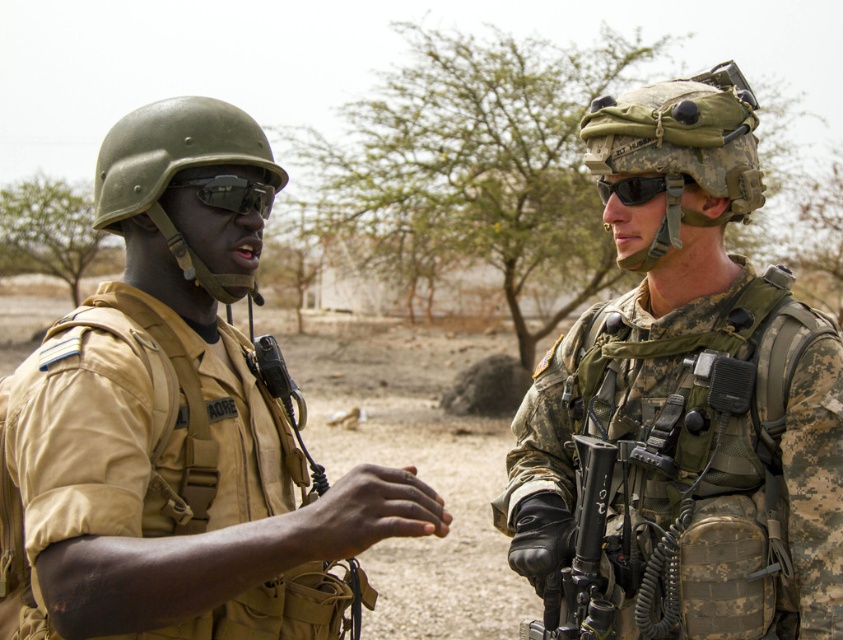
Question: Which object is closer to the camera taking this photo?

Choices:
 (A) matte black goggles at left
 (B) matte black goggles at center
 (C) green matte helmet at left
 (D) camouflage fabric helmet at center

Answer: (C)

Question: Is camouflage fabric helmet at center wider than matte black goggles at center?

Choices:
 (A) yes
 (B) no

Answer: (A)

Question: Which point is farther from the camera taking this photo?

Choices:
 (A) [199, 115]
 (B) [634, 436]

Answer: (B)

Question: Which of the following is the farthest from the observer?

Choices:
 (A) (219, 204)
 (B) (568, 588)

Answer: (B)

Question: From the image, what is the correct spatial relationship of matte khaki uniform at center in relation to matte black goggles at left?

Choices:
 (A) left
 (B) right

Answer: (A)

Question: Observing the image, what is the correct spatial positioning of camo fabric helmet at upper right in reference to matte khaki uniform at center?

Choices:
 (A) below
 (B) above

Answer: (B)